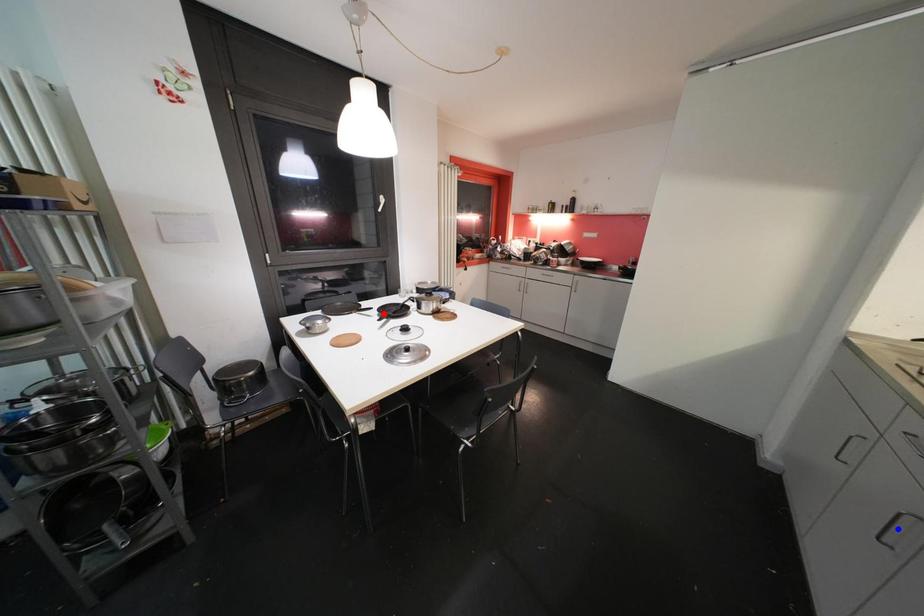
Question: Which of the two points in the image is closer to the camera?

Choices:
 (A) Blue point is closer.
 (B) Red point is closer.

Answer: (A)